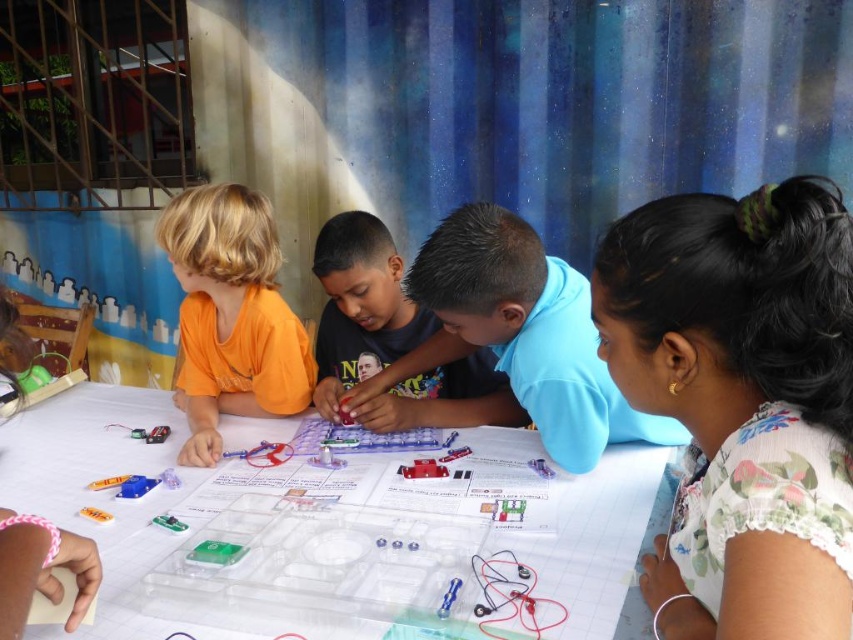
You are a teacher observing the children working on their project. You notice two children wearing orange matte shirt at left and blue matte shirt at center. Which child is sitting closer to the corrugated metal wall in the background?

The orange matte shirt at left is positioned over the blue matte shirt at center, meaning the orange matte shirt at left is closer to the corrugated metal wall in the background.